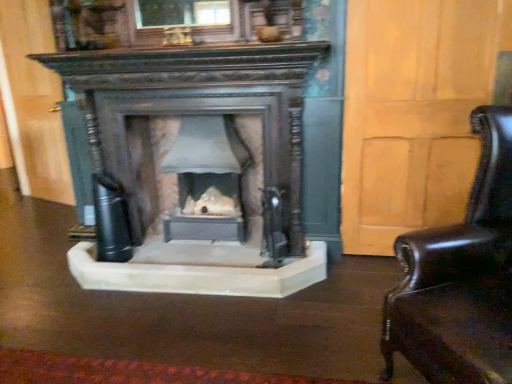
Question: Can matte gray stone fireplace at center be found inside shiny black leather swivel chair at right?

Choices:
 (A) no
 (B) yes

Answer: (A)

Question: Is shiny black leather swivel chair at right thinner than matte gray stone fireplace at center?

Choices:
 (A) no
 (B) yes

Answer: (A)

Question: Are shiny black leather swivel chair at right and matte gray stone fireplace at center making contact?

Choices:
 (A) no
 (B) yes

Answer: (A)

Question: Is shiny black leather swivel chair at right further to the viewer compared to matte gray stone fireplace at center?

Choices:
 (A) yes
 (B) no

Answer: (B)

Question: Considering the relative sizes of shiny black leather swivel chair at right and matte gray stone fireplace at center in the image provided, is shiny black leather swivel chair at right wider than matte gray stone fireplace at center?

Choices:
 (A) yes
 (B) no

Answer: (A)

Question: Considering the relative positions of shiny black leather swivel chair at right and matte gray stone fireplace at center in the image provided, is shiny black leather swivel chair at right to the left of matte gray stone fireplace at center from the viewer's perspective?

Choices:
 (A) yes
 (B) no

Answer: (B)

Question: Is there a large distance between matte gray stone fireplace at center and shiny black leather swivel chair at right?

Choices:
 (A) no
 (B) yes

Answer: (B)

Question: Does matte gray stone fireplace at center have a greater width compared to shiny black leather swivel chair at right?

Choices:
 (A) no
 (B) yes

Answer: (A)

Question: Considering the relative sizes of matte gray stone fireplace at center and shiny black leather swivel chair at right in the image provided, is matte gray stone fireplace at center smaller than shiny black leather swivel chair at right?

Choices:
 (A) yes
 (B) no

Answer: (A)

Question: Is matte gray stone fireplace at center facing away from shiny black leather swivel chair at right?

Choices:
 (A) yes
 (B) no

Answer: (B)

Question: Can you confirm if matte gray stone fireplace at center is bigger than shiny black leather swivel chair at right?

Choices:
 (A) yes
 (B) no

Answer: (B)

Question: From a real-world perspective, is matte gray stone fireplace at center beneath shiny black leather swivel chair at right?

Choices:
 (A) yes
 (B) no

Answer: (A)

Question: From a real-world perspective, is matte gray stone fireplace at center positioned above or below shiny black leather swivel chair at right?

Choices:
 (A) above
 (B) below

Answer: (B)